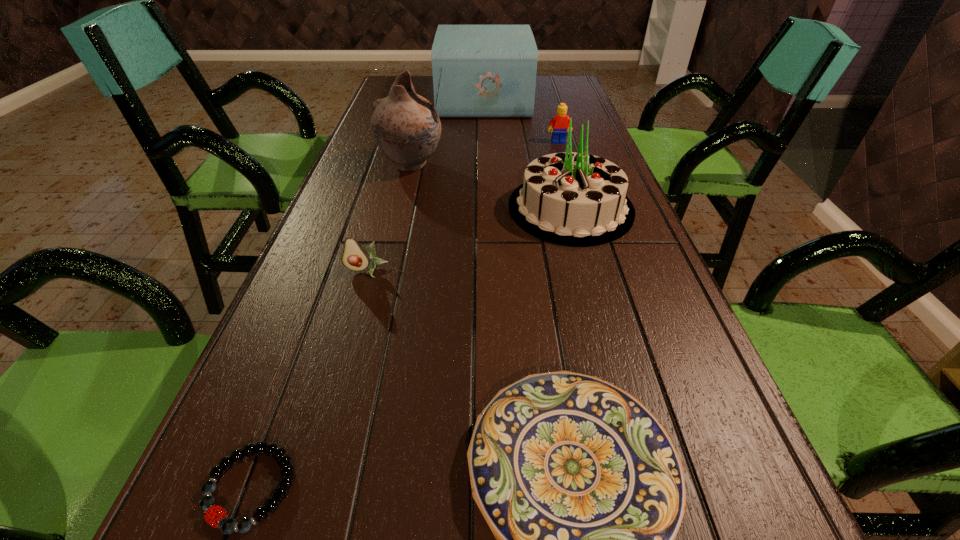
The image size is (960, 540). Find the location of `vacant position located 0.220m on the front panel of the radio receiver`. vacant position located 0.220m on the front panel of the radio receiver is located at coordinates (378, 100).

The height and width of the screenshot is (540, 960). I want to click on free spot located 0.120m on the front panel of the radio receiver, so click(405, 100).

In order to click on vacant space located on the left of the birthday cake in this screenshot , I will do (x=367, y=208).

Identify the location of vacant space located on the face of the second farthest object. (565, 165).

The height and width of the screenshot is (540, 960). Find the location of `vacant space located 0.280m on the seed side of the third shortest object`. vacant space located 0.280m on the seed side of the third shortest object is located at coordinates (329, 398).

Find the location of `vacant space situated on the back of the shortest object`. vacant space situated on the back of the shortest object is located at coordinates (280, 408).

The height and width of the screenshot is (540, 960). I want to click on object that is at the far edge, so click(479, 71).

The image size is (960, 540). In order to click on pottery that is at the left edge in this screenshot , I will do `click(406, 127)`.

What are the coordinates of `avocado that is at the left edge` in the screenshot? It's located at (354, 257).

Image resolution: width=960 pixels, height=540 pixels. Find the location of `bracelet that is at the left edge`. bracelet that is at the left edge is located at coordinates (228, 525).